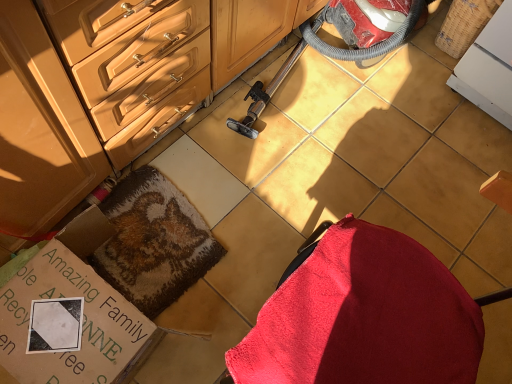
Question: Is matte wood cabinetry at center facing away from cardboard box at lower left?

Choices:
 (A) yes
 (B) no

Answer: (B)

Question: Are matte wood cabinetry at center and cardboard box at lower left making contact?

Choices:
 (A) no
 (B) yes

Answer: (A)

Question: Is matte wood cabinetry at center far from cardboard box at lower left?

Choices:
 (A) no
 (B) yes

Answer: (A)

Question: Is matte wood cabinetry at center behind cardboard box at lower left?

Choices:
 (A) yes
 (B) no

Answer: (B)

Question: Does matte wood cabinetry at center lie in front of cardboard box at lower left?

Choices:
 (A) yes
 (B) no

Answer: (A)

Question: Is matte wood cabinetry at center at the left side of cardboard box at lower left?

Choices:
 (A) yes
 (B) no

Answer: (B)

Question: Is fluffy brown rug at center thinner than matte wood cabinetry at center?

Choices:
 (A) yes
 (B) no

Answer: (A)

Question: From the image's perspective, is fluffy brown rug at center above matte wood cabinetry at center?

Choices:
 (A) no
 (B) yes

Answer: (A)

Question: Does fluffy brown rug at center have a larger size compared to matte wood cabinetry at center?

Choices:
 (A) no
 (B) yes

Answer: (A)

Question: Is fluffy brown rug at center to the right of matte wood cabinetry at center from the viewer's perspective?

Choices:
 (A) no
 (B) yes

Answer: (A)

Question: Considering the relative sizes of fluffy brown rug at center and matte wood cabinetry at center in the image provided, is fluffy brown rug at center shorter than matte wood cabinetry at center?

Choices:
 (A) no
 (B) yes

Answer: (B)

Question: Would you say matte wood cabinetry at center is part of fluffy brown rug at center's contents?

Choices:
 (A) yes
 (B) no

Answer: (B)

Question: Does red plastic vacuum cleaner at center have a greater width compared to cardboard box at lower left?

Choices:
 (A) yes
 (B) no

Answer: (A)